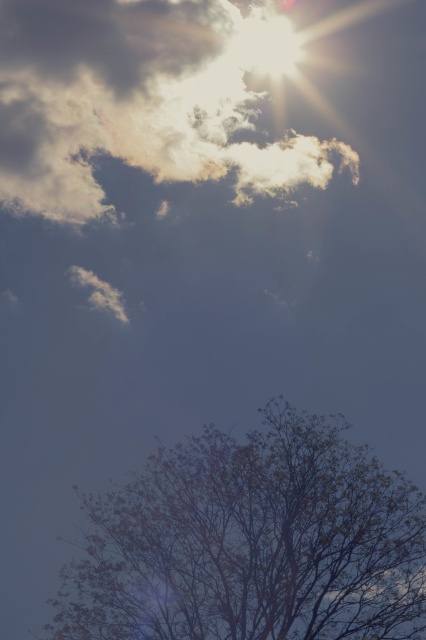
Question: Among these objects, which one is nearest to the camera?

Choices:
 (A) white fluffy cloud at upper center
 (B) bare branches at lower right

Answer: (B)

Question: Does bare branches at lower right lie behind white fluffy cloud at upper center?

Choices:
 (A) yes
 (B) no

Answer: (B)

Question: Is bare branches at lower right smaller than white fluffy cloud at upper center?

Choices:
 (A) no
 (B) yes

Answer: (A)

Question: Among these points, which one is nearest to the camera?

Choices:
 (A) (290, 444)
 (B) (42, 204)

Answer: (A)

Question: Among these objects, which one is nearest to the camera?

Choices:
 (A) bare branches at lower right
 (B) white fluffy cloud at upper center

Answer: (A)

Question: Can you confirm if bare branches at lower right is positioned below white fluffy cloud at upper center?

Choices:
 (A) no
 (B) yes

Answer: (B)